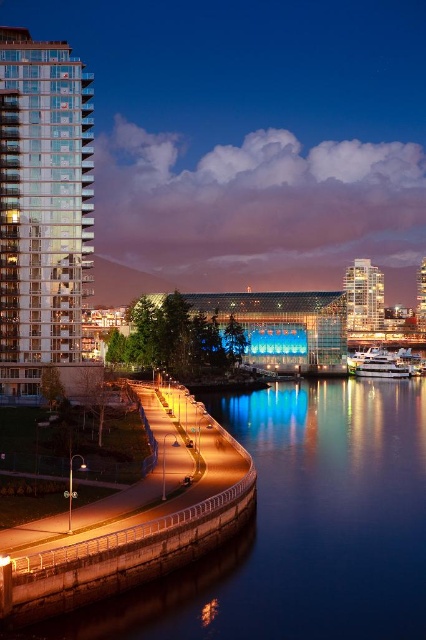
Question: Among these points, which one is farthest from the camera?

Choices:
 (A) (362, 298)
 (B) (388, 353)
 (C) (138, 637)
 (D) (60, 96)

Answer: (A)

Question: Is transparent glass building at left to the right of white glossy yacht at lower right from the viewer's perspective?

Choices:
 (A) no
 (B) yes

Answer: (A)

Question: Is transparent glass building at left smaller than white glossy yacht at lower right?

Choices:
 (A) yes
 (B) no

Answer: (A)

Question: Is blue glassy river at lower center wider than transparent glass building at left?

Choices:
 (A) yes
 (B) no

Answer: (A)

Question: Which object appears closest to the camera in this image?

Choices:
 (A) transparent glass building at left
 (B) matte glass building at upper right
 (C) blue glassy river at lower center
 (D) white glossy yacht at lower right

Answer: (C)

Question: Which point is farther to the camera?

Choices:
 (A) (350, 321)
 (B) (207, 561)
 (C) (2, 67)
 (D) (368, 374)

Answer: (A)